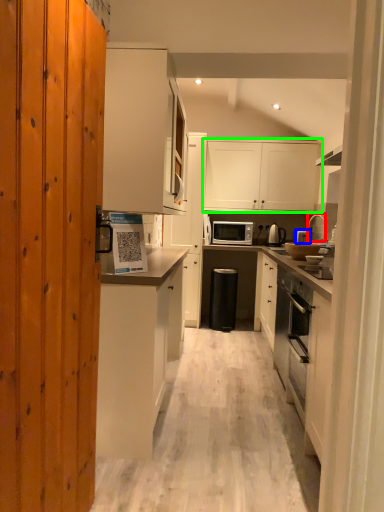
Question: Based on their relative distances, which object is farther from faucet (highlighted by a red box)? Choose from appliance (highlighted by a blue box) and cabinetry (highlighted by a green box).

Choices:
 (A) appliance
 (B) cabinetry

Answer: (B)